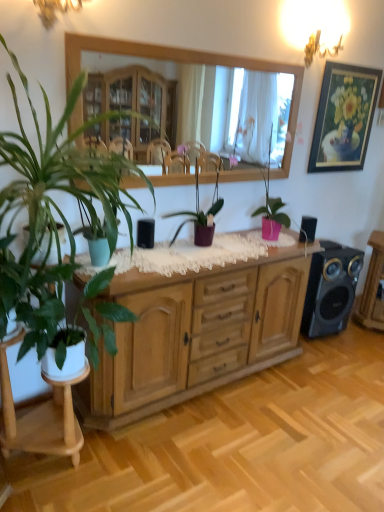
At what (x,y) coordinates should I click in order to perform the action: click on vacant area that lies in front of wooden cabinet at center. Please return your answer as a coordinate pair (x, y). Looking at the image, I should click on pos(220,449).